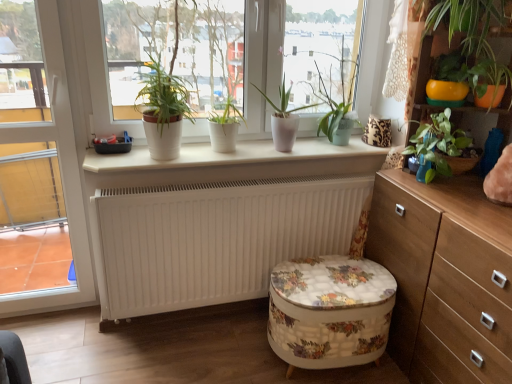
The width and height of the screenshot is (512, 384). In order to click on blank space situated above wooden chest of drawers at right (from a real-world perspective) in this screenshot , I will do `click(465, 200)`.